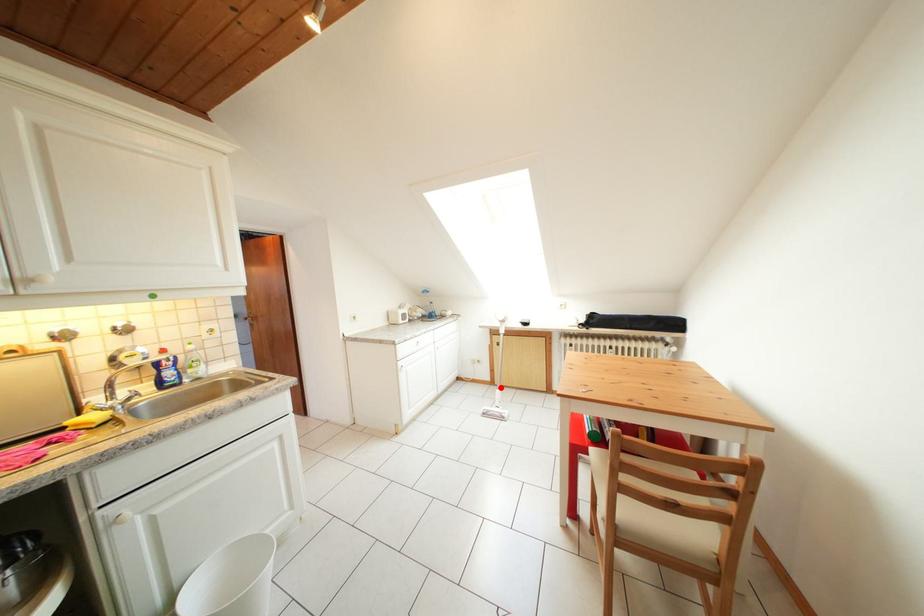
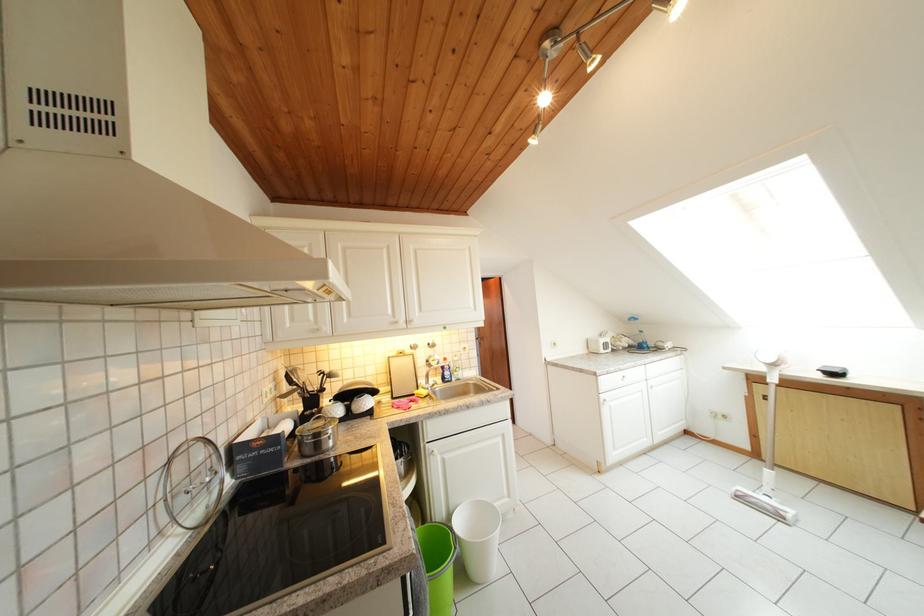
Question: I am providing you with two images of the same scene from different viewpoints. A red point is shown in image1. For the corresponding object point in image2, is it positioned nearer or farther from the camera?

Choices:
 (A) Nearer
 (B) Farther

Answer: (A)